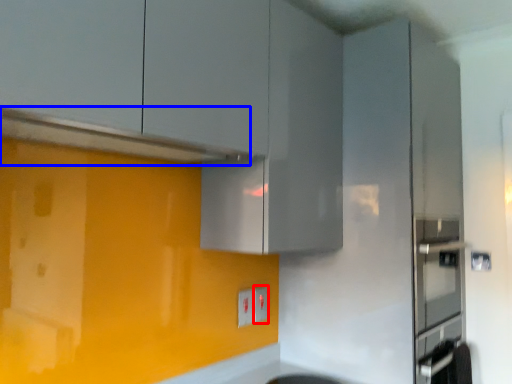
Question: Which object is further to the camera taking this photo, electric outlet (highlighted by a red box) or exhaust hood (highlighted by a blue box)?

Choices:
 (A) electric outlet
 (B) exhaust hood

Answer: (A)